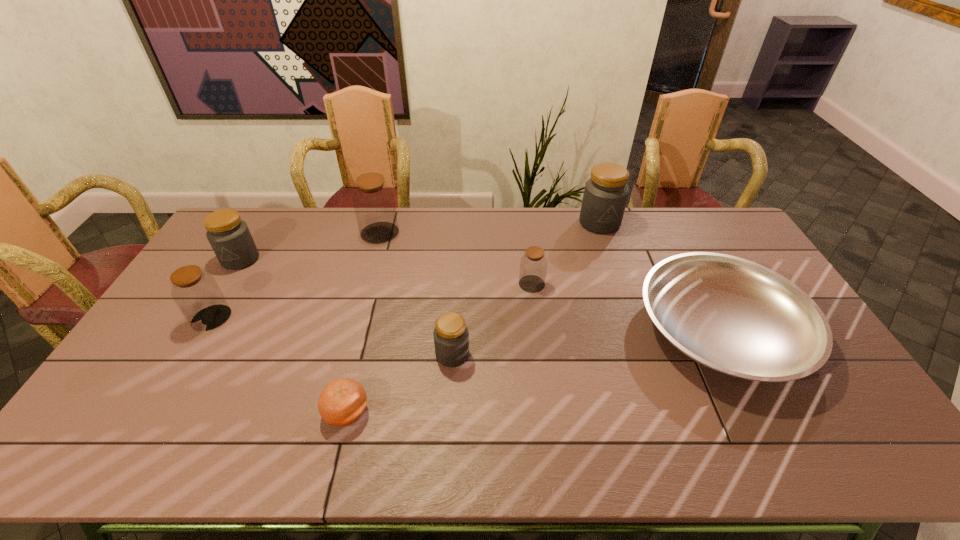
Select which jar is the third closest to the second biggest brown jar. Please provide its 2D coordinates. Your answer should be formatted as a tuple, i.e. [(x, y)], where the tuple contains the x and y coordinates of a point satisfying the conditions above.

[(451, 337)]

You are a GUI agent. You are given a task and a screenshot of the screen. Output one action in this format:
    pyautogui.click(x=<x>, y=<y>)
    Task: Click on the jar that is the third closest to the second jar from right to left
    The image size is (960, 540).
    Given the screenshot: What is the action you would take?
    pyautogui.click(x=374, y=204)

The width and height of the screenshot is (960, 540). What are the coordinates of `brown jar that can be found as the second closest to the second smallest brown jar` in the screenshot? It's located at pos(533,266).

This screenshot has width=960, height=540. I want to click on brown jar that is the closest to the farthest brown jar, so click(x=198, y=296).

You are a GUI agent. You are given a task and a screenshot of the screen. Output one action in this format:
    pyautogui.click(x=<x>, y=<y>)
    Task: Click on the gray jar that is the closest to the sixth object from left to right
    
    Given the screenshot: What is the action you would take?
    pyautogui.click(x=451, y=337)

Find the location of a particular element. The height and width of the screenshot is (540, 960). the closest gray jar to the rightmost jar is located at coordinates (451, 337).

Locate an element on the screen. The height and width of the screenshot is (540, 960). free space that satisfies the following two spatial constraints: 1. on the surface of the farthest gray jar near the warning symbol; 2. on the surface of the third jar from right to left near the warning symbol is located at coordinates (643, 354).

At what (x,y) coordinates should I click in order to perform the action: click on free region that satisfies the following two spatial constraints: 1. on the front side of the fifth jar from left to right; 2. on the right side of the bedpan. Please return your answer as a coordinate pair (x, y). The height and width of the screenshot is (540, 960). Looking at the image, I should click on (538, 330).

Where is `free space that satisfies the following two spatial constraints: 1. on the surface of the clementine near the warning symbol; 2. on the left side of the sixth nearest object`? Image resolution: width=960 pixels, height=540 pixels. free space that satisfies the following two spatial constraints: 1. on the surface of the clementine near the warning symbol; 2. on the left side of the sixth nearest object is located at coordinates (148, 412).